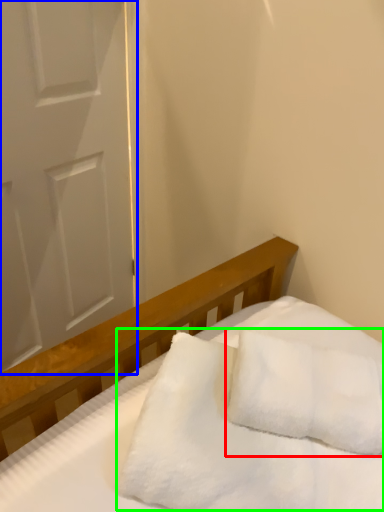
Question: Which object is positioned farthest from pillow (highlighted by a red box)? Select from door (highlighted by a blue box) and blanket (highlighted by a green box).

Choices:
 (A) door
 (B) blanket

Answer: (A)